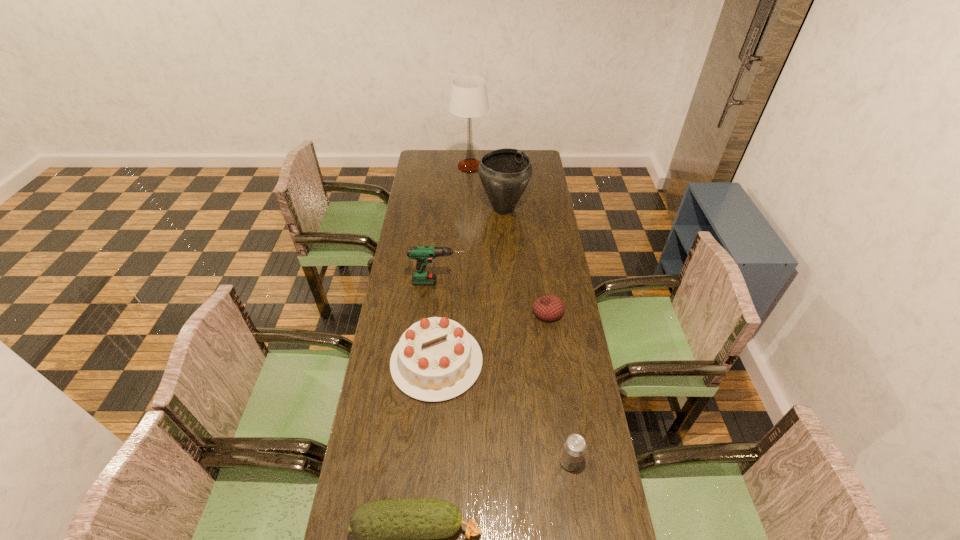
Identify the location of table lamp. (469, 98).

At what (x,y) coordinates should I click in order to perform the action: click on the tallest object. Please return your answer as a coordinate pair (x, y). Looking at the image, I should click on (469, 98).

What are the coordinates of `the sixth shortest object` in the screenshot? It's located at (505, 173).

The image size is (960, 540). I want to click on urn, so click(505, 173).

Locate an element on the screen. The height and width of the screenshot is (540, 960). the third tallest object is located at coordinates pyautogui.click(x=423, y=254).

The image size is (960, 540). Identify the location of the third farthest object. (423, 254).

You are a GUI agent. You are given a task and a screenshot of the screen. Output one action in this format:
    pyautogui.click(x=<x>, y=<y>)
    Task: Click on the fourth tallest object
    Image resolution: width=960 pixels, height=540 pixels.
    Given the screenshot: What is the action you would take?
    click(x=436, y=359)

Locate an element on the screen. the third nearest object is located at coordinates (436, 359).

Where is `the third shortest object`? The height and width of the screenshot is (540, 960). the third shortest object is located at coordinates (574, 448).

The width and height of the screenshot is (960, 540). What are the coordinates of `beer can` in the screenshot? It's located at (574, 448).